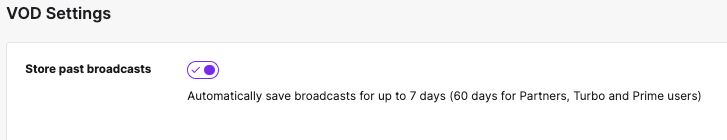
Image resolution: width=727 pixels, height=140 pixels. Identify the location of purple switch button. (206, 66).